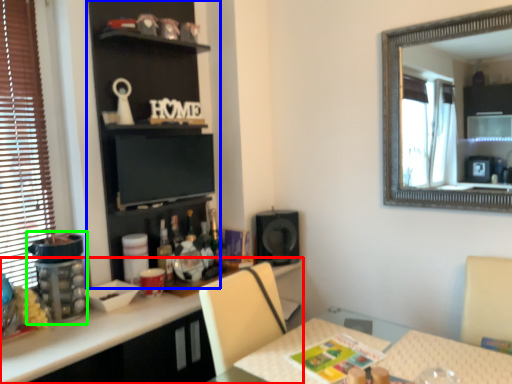
Question: Which is farther away from cabinetry (highlighted by a red box)? bookshelf (highlighted by a blue box) or appliance (highlighted by a green box)?

Choices:
 (A) bookshelf
 (B) appliance

Answer: (A)